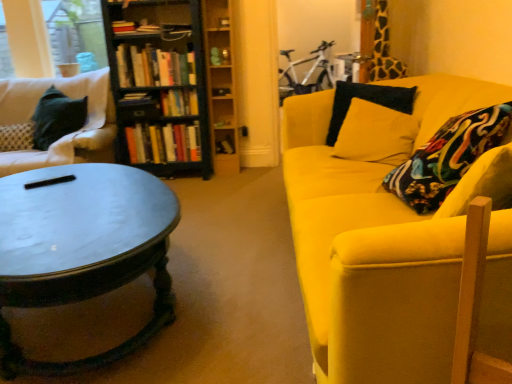
Image resolution: width=512 pixels, height=384 pixels. Identify the location of vacant area on top of hardcover book at center, marked as the 4th book in a top-to-bottom arrangement (from a real-world perspective). [139, 95].